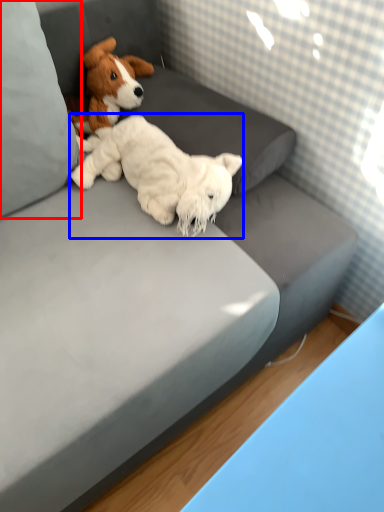
Question: Among these objects, which one is farthest to the camera, pillow (highlighted by a red box) or dog (highlighted by a blue box)?

Choices:
 (A) pillow
 (B) dog

Answer: (B)